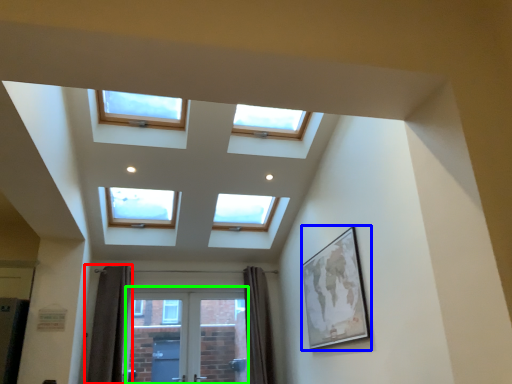
Question: Considering the real-world distances, which object is farthest from curtain (highlighted by a red box)? picture frame (highlighted by a blue box) or screen door (highlighted by a green box)?

Choices:
 (A) picture frame
 (B) screen door

Answer: (A)